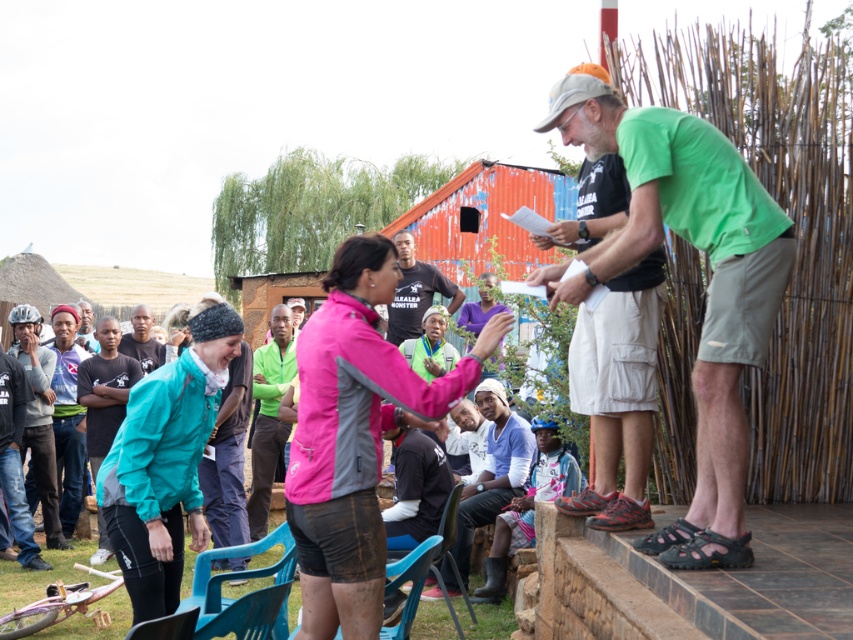
Question: Can you confirm if blue plastic chair at lower left is thinner than black matte t-shirt at center?

Choices:
 (A) no
 (B) yes

Answer: (B)

Question: Can you confirm if brushed metal helmet at left is thinner than black t-shirt at center?

Choices:
 (A) yes
 (B) no

Answer: (B)

Question: Is green fabric shirt at center to the right of plastic chair at center from the viewer's perspective?

Choices:
 (A) no
 (B) yes

Answer: (A)

Question: Which of the following is the closest to the observer?

Choices:
 (A) blue cotton shirt at center
 (B) black matte t-shirt at center
 (C) black t-shirt at center
 (D) blue plastic chair at lower left

Answer: (D)

Question: Which object is the closest to the brushed metal helmet at left?

Choices:
 (A) blue cotton shirt at center
 (B) green fabric shirt at center
 (C) plastic chair at center

Answer: (B)

Question: Which object is the farthest from the black t-shirt at center?

Choices:
 (A) black matte t-shirt at center
 (B) brushed metal helmet at left
 (C) blue plastic chair at lower left

Answer: (C)